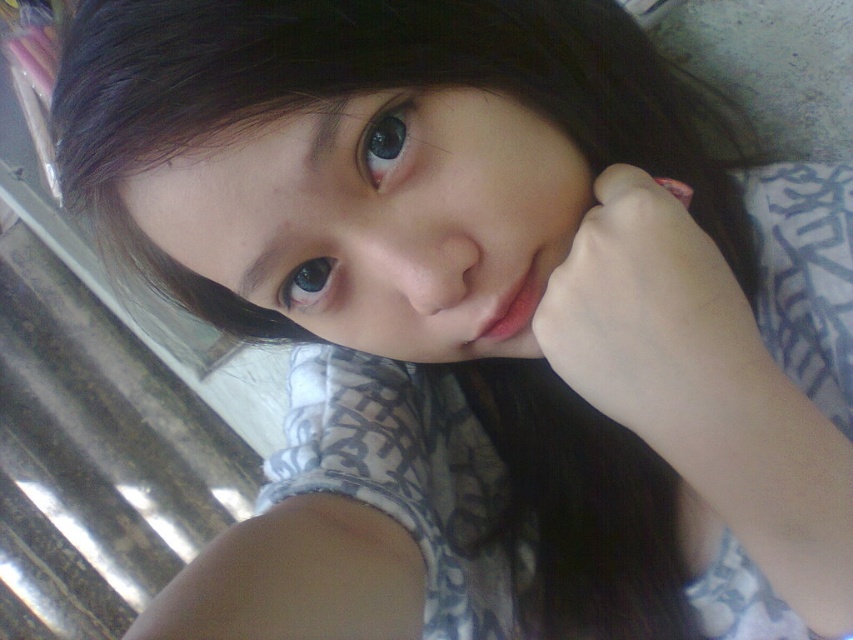
Question: Does pale skin/hair at cheek appear on the left side of blue glossy eye at upper center?

Choices:
 (A) no
 (B) yes

Answer: (A)

Question: Does pink matte lips at center appear on the right side of blue glossy eye at center?

Choices:
 (A) no
 (B) yes

Answer: (B)

Question: Is pale skin/hair at cheek wider than blue glossy eye at upper center?

Choices:
 (A) no
 (B) yes

Answer: (B)

Question: Which object is closer to the camera taking this photo?

Choices:
 (A) pink matte lips at center
 (B) blue glossy eye at upper center

Answer: (B)

Question: Which of the following is the closest to the observer?

Choices:
 (A) (286, 278)
 (B) (393, 152)

Answer: (B)

Question: Estimate the real-world distances between objects in this image. Which object is farther from the blue glossy eye at center?

Choices:
 (A) pale skin/hair at cheek
 (B) blue glossy eye at upper center
 (C) pink matte lips at center

Answer: (A)